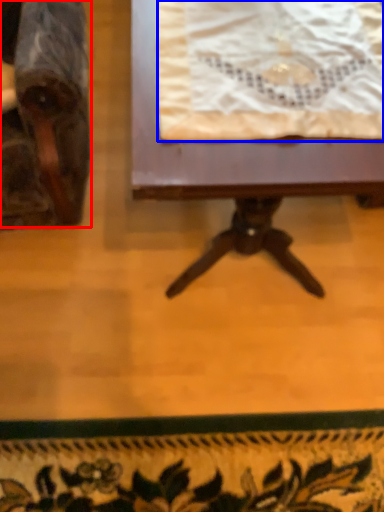
Question: Which object appears closest to the camera in this image, chair (highlighted by a red box) or blanket (highlighted by a blue box)?

Choices:
 (A) chair
 (B) blanket

Answer: (A)